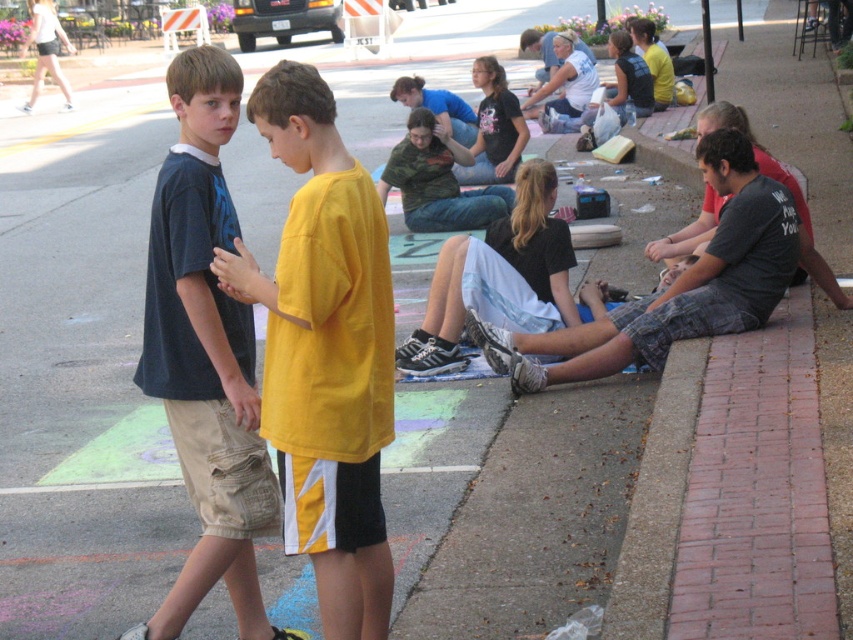
You are standing at the origin point of the coordinate system in this street scene. A friend asks you to locate the yellow matte shirt at center. What are its coordinates?

The yellow matte shirt at center is located at coordinates point (325, 353).

You are standing at the camera position and see two points in the scene. The first point is at coordinates point (x=273, y=83) and the second is at point (x=245, y=637). Which point is closer to you?

Point (x=273, y=83) is closer to the camera than point (x=245, y=637).